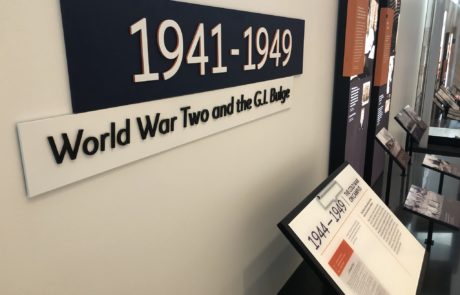
The image size is (460, 295). Identify the location of pictures on wall displays over pedestals, upper right. (370, 37), (366, 102).